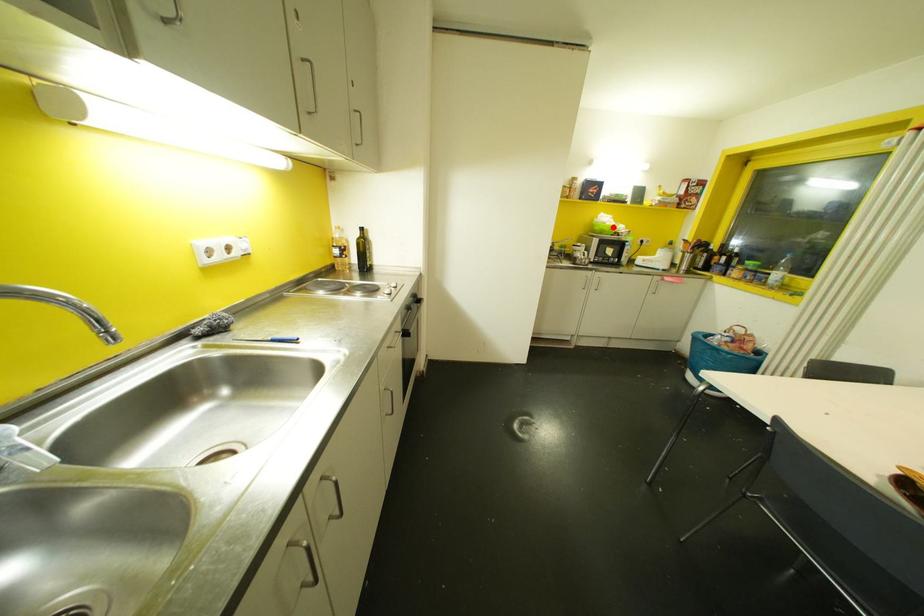
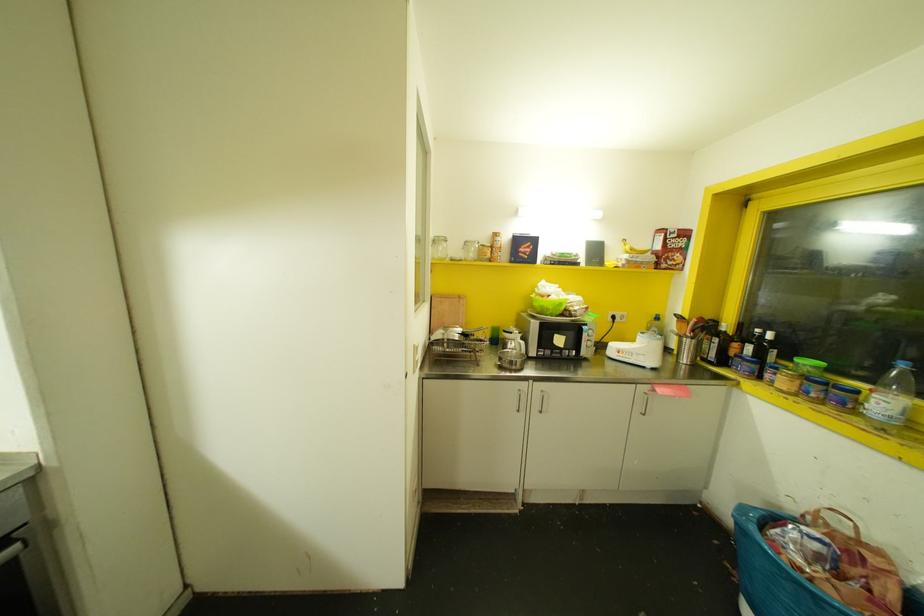
Question: I am providing you with two images of the same scene from different viewpoints. A red point is shown in image1. For the corresponding object point in image2, is it positioned nearer or farther from the camera?

Choices:
 (A) Nearer
 (B) Farther

Answer: (B)